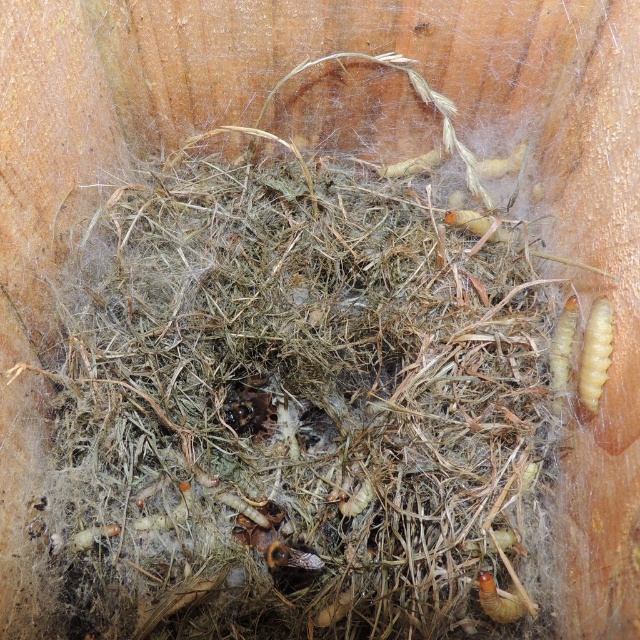
Question: Which object is positioned farthest from the brown fuzzy larva at lower right?

Choices:
 (A) yellowish translucent caterpillar at right
 (B) yellowish matte caterpillar at right

Answer: (A)

Question: Is yellowish translucent caterpillar at right thinner than yellowish matte caterpillar at right?

Choices:
 (A) no
 (B) yes

Answer: (B)

Question: Considering the real-world distances, which object is farthest from the yellowish matte caterpillar at right?

Choices:
 (A) yellowish translucent caterpillar at right
 (B) brown fuzzy larva at lower right

Answer: (B)

Question: Is yellowish translucent caterpillar at right to the right of yellowish matte caterpillar at right from the viewer's perspective?

Choices:
 (A) yes
 (B) no

Answer: (A)

Question: Which is farther from the brown fuzzy larva at lower right?

Choices:
 (A) yellowish matte caterpillar at right
 (B) yellowish translucent caterpillar at right

Answer: (B)

Question: Is yellowish translucent caterpillar at right above brown fuzzy larva at lower right?

Choices:
 (A) yes
 (B) no

Answer: (A)